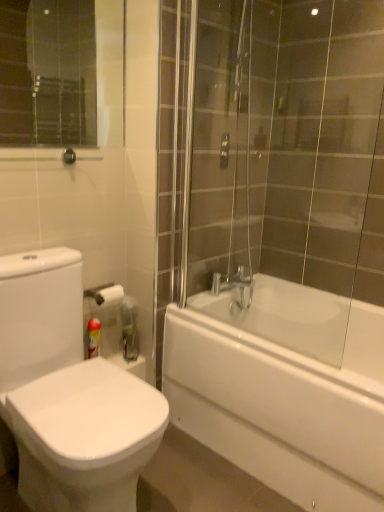
Question: In terms of width, does white glossy bathtub at right look wider or thinner when compared to red plastic can at lower left?

Choices:
 (A) thin
 (B) wide

Answer: (B)

Question: Relative to red plastic can at lower left, is white glossy bathtub at right in front or behind?

Choices:
 (A) front
 (B) behind

Answer: (A)

Question: Which object is positioned closest to the white glossy bidet at lower left?

Choices:
 (A) red plastic can at lower left
 (B) white glossy bathtub at right

Answer: (A)

Question: Which of these objects is positioned closest to the red plastic can at lower left?

Choices:
 (A) white glossy bidet at lower left
 (B) white glossy bathtub at right

Answer: (A)